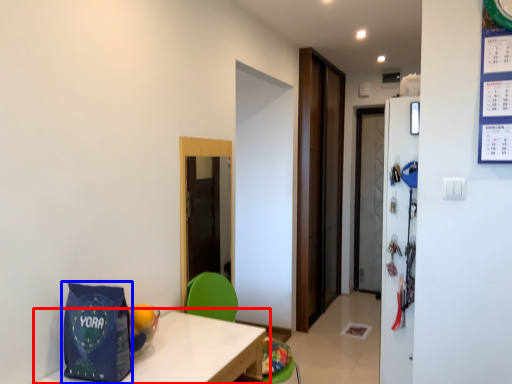
Question: Which point is further to the camera, table (highlighted by a red box) or gift bag (highlighted by a blue box)?

Choices:
 (A) table
 (B) gift bag

Answer: (B)